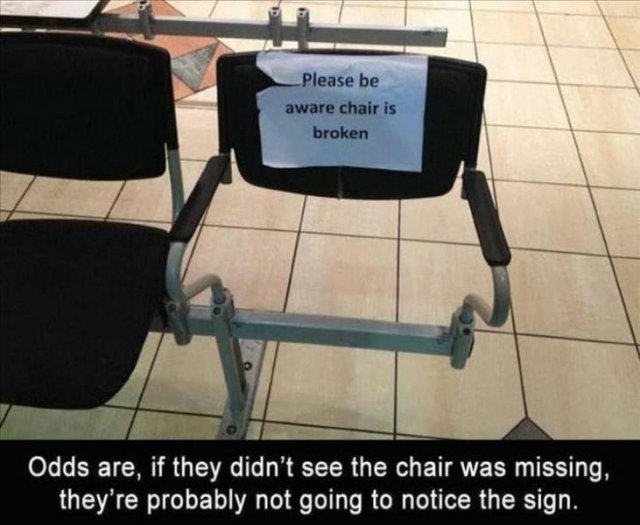
Find the location of a particular element. The height and width of the screenshot is (525, 640). chair is located at coordinates (464, 116).